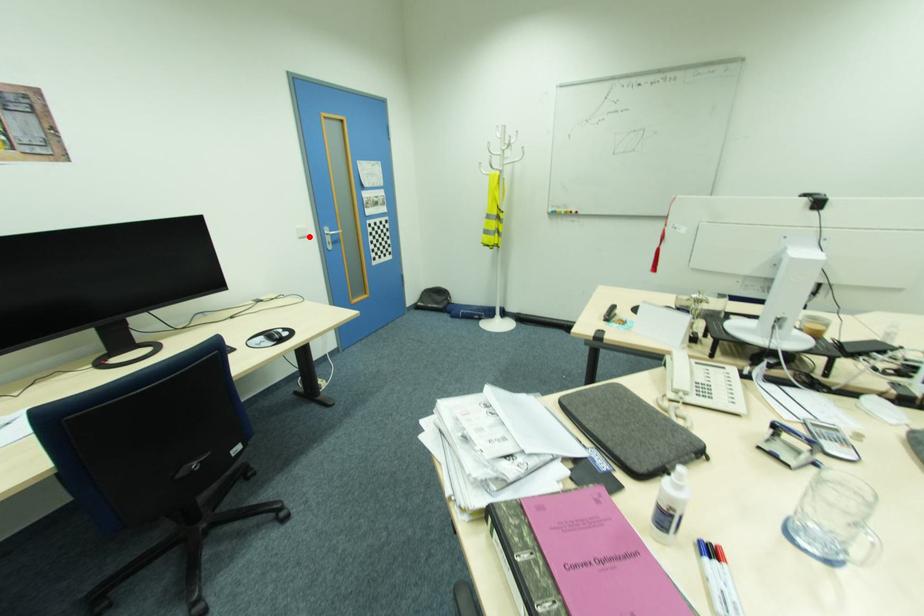
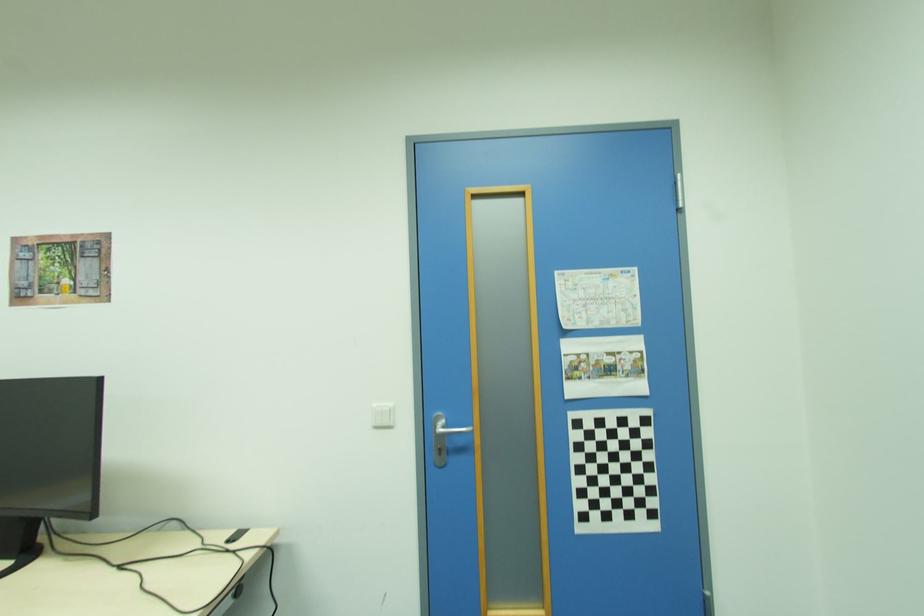
The point at the highlighted location is marked in the first image. Where is the corresponding point in the second image?

(394, 427)